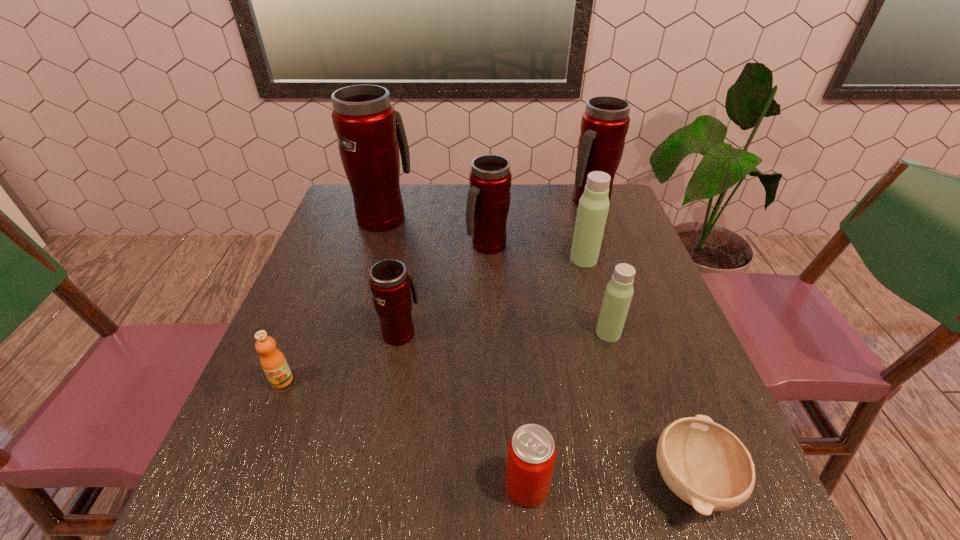
Find the location of a particular element. free space between the fifth shortest thermos bottle and the red can is located at coordinates (558, 344).

You are a GUI agent. You are given a task and a screenshot of the screen. Output one action in this format:
    pyautogui.click(x=<x>, y=<y>)
    Task: Click on the vacant space in between the second red thermos bottle from right to left and the can
    
    Given the screenshot: What is the action you would take?
    pyautogui.click(x=507, y=366)

The height and width of the screenshot is (540, 960). Identify the location of free space between the third nearest object and the bigger light thermos bottle. (433, 320).

Find the location of `free space between the smallest red thermos bottle and the third biggest red thermos bottle`. free space between the smallest red thermos bottle and the third biggest red thermos bottle is located at coordinates (444, 289).

The height and width of the screenshot is (540, 960). I want to click on vacant space that's between the can and the third thermos bottle from left to right, so click(507, 366).

The height and width of the screenshot is (540, 960). Find the location of `empty location between the second tallest thermos bottle and the beige bowl`. empty location between the second tallest thermos bottle and the beige bowl is located at coordinates (640, 341).

You are a GUI agent. You are given a task and a screenshot of the screen. Output one action in this format:
    pyautogui.click(x=<x>, y=<y>)
    Task: Click on the free spot between the shortest object and the second biggest red thermos bottle
    The width and height of the screenshot is (960, 540).
    Given the screenshot: What is the action you would take?
    pyautogui.click(x=640, y=341)

At what (x,y) coordinates should I click in order to perform the action: click on free space between the third biggest red thermos bottle and the shortest object. Please return your answer as a coordinate pair (x, y). The width and height of the screenshot is (960, 540). Looking at the image, I should click on (589, 363).

Where is `object that is the sixth nearest to the tallest thermos bottle`? The image size is (960, 540). object that is the sixth nearest to the tallest thermos bottle is located at coordinates (619, 291).

Locate an element on the screen. This screenshot has width=960, height=540. object that is the third closest one to the farther light thermos bottle is located at coordinates (619, 291).